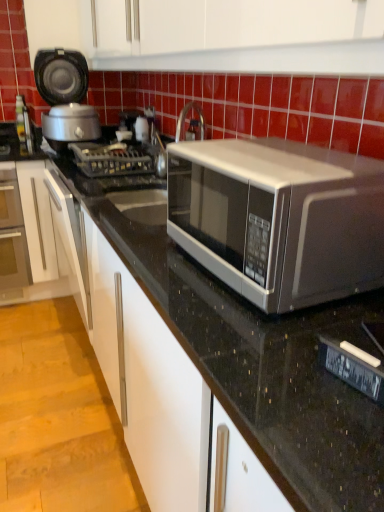
Measure the distance between point [187,240] and camera.

Point [187,240] is 3.40 feet from camera.

Where is `matte glass oven at left`? This screenshot has width=384, height=512. matte glass oven at left is located at coordinates (12, 236).

The width and height of the screenshot is (384, 512). I want to click on matte black rice cooker at left, so pyautogui.click(x=65, y=97).

How far apart are satin silver microwave at center and metallic gray gas stove at center?

3.33 feet.

Between satin silver microwave at center and metallic gray gas stove at center, which one has more height?

satin silver microwave at center.

From a real-world perspective, is satin silver microwave at center positioned above or below metallic gray gas stove at center?

satin silver microwave at center is above metallic gray gas stove at center.

Which is more to the right, satin silver microwave at center or metallic gray gas stove at center?

satin silver microwave at center.

Is satin silver microwave at center directly adjacent to matte black rice cooker at left?

No, satin silver microwave at center is not touching matte black rice cooker at left.

In terms of height, does satin silver microwave at center look taller or shorter compared to matte black rice cooker at left?

Clearly, satin silver microwave at center is shorter compared to matte black rice cooker at left.

Is satin silver microwave at center not within matte black rice cooker at left?

satin silver microwave at center lies outside matte black rice cooker at left's area.

Locate an element on the screen. This screenshot has width=384, height=512. appliance that appears on the left of satin silver microwave at center is located at coordinates (65, 97).

Considering the positions of objects metallic gray gas stove at center and satin silver microwave at center in the image provided, who is behind, metallic gray gas stove at center or satin silver microwave at center?

metallic gray gas stove at center is more distant.

Can you tell me how much metallic gray gas stove at center and satin silver microwave at center differ in facing direction?

There is a 0.000626-degree angle between the facing directions of metallic gray gas stove at center and satin silver microwave at center.

From a real-world perspective, is metallic gray gas stove at center physically located above or below satin silver microwave at center?

In terms of real-world spatial position, metallic gray gas stove at center is below satin silver microwave at center.

From the image's perspective, is metallic gray gas stove at center on top of satin silver microwave at center?

Yes.

Considering the positions of point (75, 134) and point (28, 276), is point (75, 134) closer or farther from the camera than point (28, 276)?

Point (75, 134) is positioned closer to the camera compared to point (28, 276).

Does matte black rice cooker at left have a larger size compared to matte glass oven at left?

No.

Is matte glass oven at left a part of matte black rice cooker at left?

No.

Is metallic gray gas stove at center taller than matte glass oven at left?

No.

Are metallic gray gas stove at center and matte glass oven at left beside each other?

No, metallic gray gas stove at center is not touching matte glass oven at left.

The height and width of the screenshot is (512, 384). Find the location of `oven that appears below the metallic gray gas stove at center (from the image's perspective)`. oven that appears below the metallic gray gas stove at center (from the image's perspective) is located at coordinates tap(12, 236).

Is satin silver microwave at center oriented towards matte glass oven at left?

No, satin silver microwave at center is not turned towards matte glass oven at left.

From a real-world perspective, who is located higher, satin silver microwave at center or matte glass oven at left?

satin silver microwave at center is physically above.

Where is `oven lying above the satin silver microwave at center (from the image's perspective)`? oven lying above the satin silver microwave at center (from the image's perspective) is located at coordinates (12, 236).

How distant is metallic gray gas stove at center from matte black rice cooker at left?

metallic gray gas stove at center is 34.36 centimeters away from matte black rice cooker at left.

The image size is (384, 512). I want to click on appliance above the metallic gray gas stove at center (from a real-world perspective), so click(65, 97).

Which point is more forward, (x=110, y=144) or (x=85, y=88)?

The point (x=110, y=144) is closer.

Is the position of metallic gray gas stove at center less distant than that of matte black rice cooker at left?

Yes.

Find the location of a particular element. gas stove behind the satin silver microwave at center is located at coordinates (118, 159).

At what (x,y) coordinates should I click in order to perform the action: click on appliance positioned vertically above the satin silver microwave at center (from a real-world perspective). Please return your answer as a coordinate pair (x, y). Looking at the image, I should click on (65, 97).

Estimate the real-world distances between objects in this image. Which object is further from matte glass oven at left, satin silver microwave at center or matte black rice cooker at left?

satin silver microwave at center is positioned further to the anchor matte glass oven at left.

Which object lies nearer to the anchor point satin silver microwave at center, metallic gray gas stove at center or matte glass oven at left?

metallic gray gas stove at center is closer to satin silver microwave at center.

Based on their spatial positions, is metallic gray gas stove at center or satin silver microwave at center further from matte glass oven at left?

satin silver microwave at center is positioned further to the anchor matte glass oven at left.

When comparing their distances from metallic gray gas stove at center, does matte glass oven at left or satin silver microwave at center seem further?

satin silver microwave at center.

Based on their spatial positions, is satin silver microwave at center or matte black rice cooker at left further from metallic gray gas stove at center?

Based on the image, satin silver microwave at center appears to be further to metallic gray gas stove at center.

From the image, which object appears to be farther from matte black rice cooker at left, satin silver microwave at center or matte glass oven at left?

Based on the image, satin silver microwave at center appears to be further to matte black rice cooker at left.

When comparing their distances from metallic gray gas stove at center, does matte black rice cooker at left or satin silver microwave at center seem closer?

matte black rice cooker at left lies closer to metallic gray gas stove at center than the other object.

From the image, which object appears to be nearer to matte glass oven at left, matte black rice cooker at left or satin silver microwave at center?

Among the two, matte black rice cooker at left is located nearer to matte glass oven at left.

Identify the location of gas stove between satin silver microwave at center and matte black rice cooker at left along the z-axis. (118, 159).

Where is `appliance situated between matte glass oven at left and metallic gray gas stove at center from left to right`? This screenshot has height=512, width=384. appliance situated between matte glass oven at left and metallic gray gas stove at center from left to right is located at coordinates (65, 97).

Image resolution: width=384 pixels, height=512 pixels. Find the location of `gas stove between satin silver microwave at center and matte glass oven at left from front to back`. gas stove between satin silver microwave at center and matte glass oven at left from front to back is located at coordinates (118, 159).

Where is `appliance located between satin silver microwave at center and matte glass oven at left in the depth direction`? The width and height of the screenshot is (384, 512). appliance located between satin silver microwave at center and matte glass oven at left in the depth direction is located at coordinates coord(65,97).